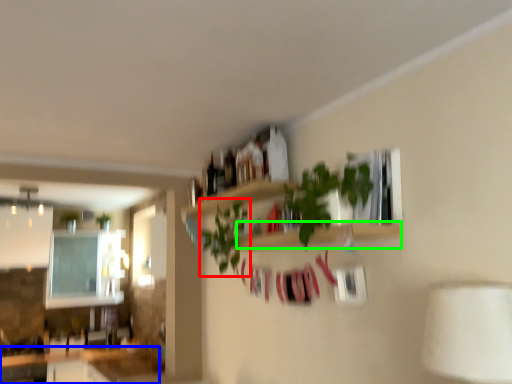
Question: Which object is the farthest from plant (highlighted by a red box)? Choose among these: counter top (highlighted by a blue box) or shelf (highlighted by a green box).

Choices:
 (A) counter top
 (B) shelf

Answer: (A)